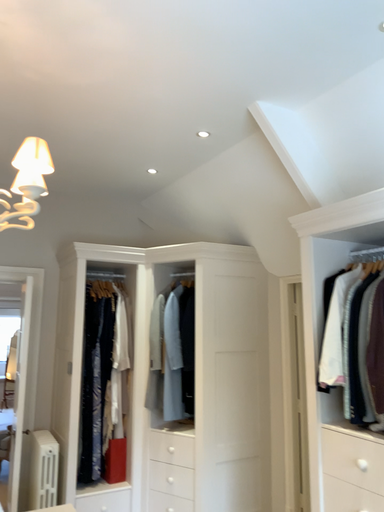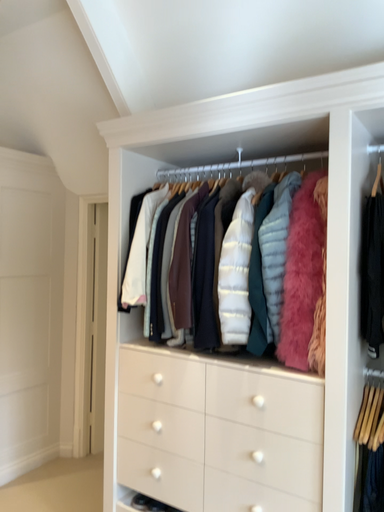
Question: Which way did the camera rotate in the video?

Choices:
 (A) rotated left
 (B) rotated right

Answer: (B)